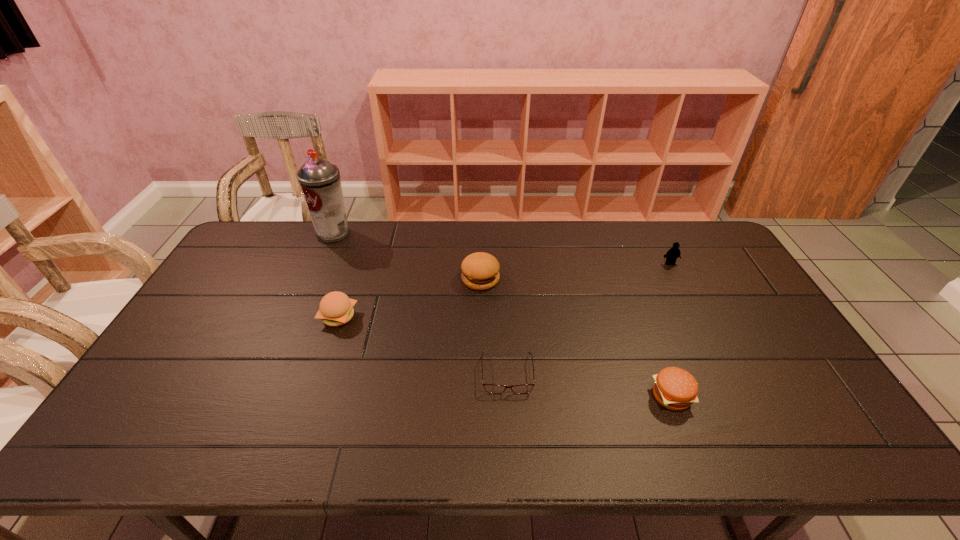
I want to click on spectacles, so click(490, 388).

Identify the location of vacant point located 0.340m on the front of the aerosol can. (300, 312).

You are a GUI agent. You are given a task and a screenshot of the screen. Output one action in this format:
    pyautogui.click(x=<x>, y=<y>)
    Task: Click on the vacant space located on the face of the fifth nearest object
    This screenshot has height=540, width=960.
    Given the screenshot: What is the action you would take?
    pyautogui.click(x=679, y=281)

Identify the location of vacant space located 0.150m on the left of the farthest hamburger. (416, 279).

At what (x,y) coordinates should I click in order to perform the action: click on free space located 0.050m on the right of the second farthest hamburger. Please return your answer as a coordinate pair (x, y). Looking at the image, I should click on (373, 316).

Identify the location of free location located on the right of the nearest hamburger. (754, 396).

Image resolution: width=960 pixels, height=540 pixels. Identify the location of object situated at the far edge. (319, 180).

This screenshot has width=960, height=540. In order to click on vacant region at the far edge of the desktop in this screenshot , I will do `click(452, 253)`.

Identify the location of vacant region at the near edge of the desktop. The width and height of the screenshot is (960, 540). (222, 444).

In the image, there is a desktop. Where is `free region at the left edge`? Image resolution: width=960 pixels, height=540 pixels. free region at the left edge is located at coordinates (221, 343).